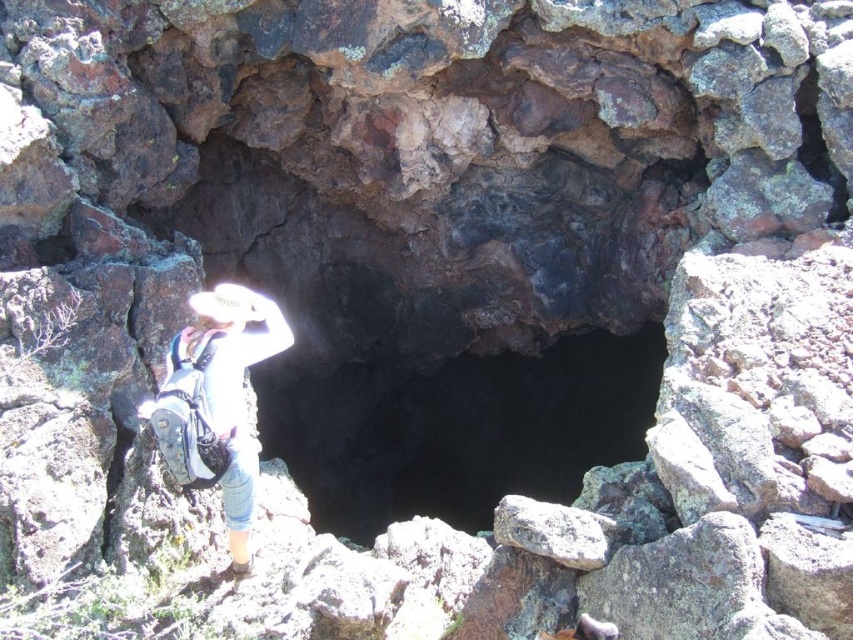
You are a hiker who wants to enter the cave through the black rock hole at center. Your backpack is 2 feet wide. Can you fit through the opening?

The black rock hole at center is 40.08 feet wide. Since your backpack is only 2 feet wide, you can easily fit through the opening.

From the picture: You are a hiker who wants to enter the cave. You see the black rock hole at center and the white fabric hat at upper center. Which object is positioned higher in the image?

The white fabric hat at upper center is positioned higher in the image than the black rock hole at center.

You are a hiker who wants to enter the cave. The entrance is the black rock hole at center. You have a white fabric hat at upper center. Which object is bigger in size?

The black rock hole at center is larger in size compared to the white fabric hat at upper center.